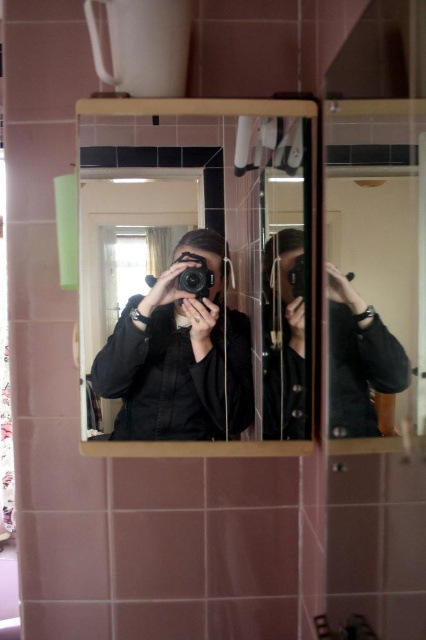
Question: Is black matte camera at right bigger than black matte camera at center?

Choices:
 (A) yes
 (B) no

Answer: (A)

Question: Which object is closer to the camera taking this photo?

Choices:
 (A) matte black jacket at center
 (B) black matte camera at right

Answer: (B)

Question: Based on their relative distances, which object is nearer to the matte black jacket at center?

Choices:
 (A) black matte camera at center
 (B) black plastic camera at center
 (C) black glossy mirror at center

Answer: (C)

Question: Which object is farther from the camera taking this photo?

Choices:
 (A) black plastic camera at center
 (B) black matte camera at center
 (C) black matte camera at right
 (D) matte black jacket at center

Answer: (B)

Question: From the image, what is the correct spatial relationship of black glossy mirror at center in relation to black plastic camera at center?

Choices:
 (A) left
 (B) right

Answer: (B)

Question: Can you confirm if black glossy mirror at center is positioned to the left of black plastic camera at center?

Choices:
 (A) yes
 (B) no

Answer: (B)